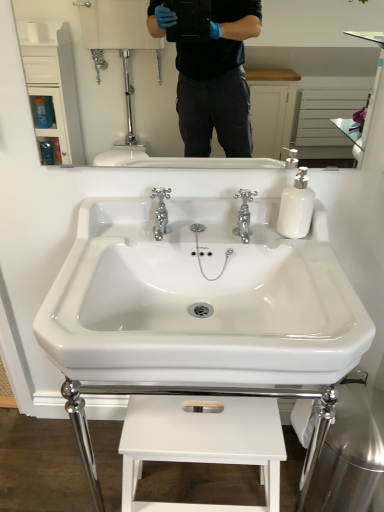
Measure the distance between point (168, 226) and camera.

The distance of point (168, 226) from camera is 3.53 feet.

The image size is (384, 512). What do you see at coordinates (201, 300) in the screenshot? I see `white glossy sink at center` at bounding box center [201, 300].

What do you see at coordinates (202, 442) in the screenshot? This screenshot has height=512, width=384. I see `white matte stool at lower center` at bounding box center [202, 442].

The height and width of the screenshot is (512, 384). What do you see at coordinates (318, 41) in the screenshot?
I see `white glossy mirror at upper center` at bounding box center [318, 41].

What is the approximate width of white glossy mirror at upper center?

white glossy mirror at upper center is 0.83 inches in width.

I want to click on white glossy soap dispenser at right, so click(x=296, y=207).

From the image's perspective, which one is positioned lower, chrome metallic faucet at center, the 2th tap from the left, or white glossy mirror at upper center?

chrome metallic faucet at center, the 2th tap from the left, appears lower in the image.

Is chrome metallic faucet at center, acting as the 1th tap starting from the right, wider than white glossy mirror at upper center?

Correct, the width of chrome metallic faucet at center, acting as the 1th tap starting from the right, exceeds that of white glossy mirror at upper center.

Can you tell me how much chrome metallic faucet at center, the 2th tap from the left, and white glossy mirror at upper center differ in facing direction?

0.421 degrees separate the facing orientations of chrome metallic faucet at center, the 2th tap from the left, and white glossy mirror at upper center.

Considering the sizes of objects chrome metallic faucet at center, acting as the 1th tap starting from the right, and white glossy mirror at upper center in the image provided, who is taller, chrome metallic faucet at center, acting as the 1th tap starting from the right, or white glossy mirror at upper center?

white glossy mirror at upper center.

From a real-world perspective, who is located higher, white glossy mirror at upper center or chrome metallic faucet at center, the 2th tap from the left?

white glossy mirror at upper center is physically above.

Considering the sizes of objects white glossy mirror at upper center and chrome metallic faucet at center, acting as the 1th tap starting from the right, in the image provided, who is taller, white glossy mirror at upper center or chrome metallic faucet at center, acting as the 1th tap starting from the right,?

white glossy mirror at upper center.

Is white glossy mirror at upper center positioned with its back to chrome metallic faucet at center, acting as the 1th tap starting from the right?

white glossy mirror at upper center is not turned away from chrome metallic faucet at center, acting as the 1th tap starting from the right.

Considering the relative positions of white glossy mirror at upper center and chrome metallic faucet at center, the 2th tap from the left, in the image provided, is white glossy mirror at upper center in front of chrome metallic faucet at center, the 2th tap from the left,?

Yes, white glossy mirror at upper center is closer to the viewer.

Between white glossy soap dispenser at right and white glossy sink at center, which one has less height?

white glossy soap dispenser at right is shorter.

Does white glossy soap dispenser at right turn towards white glossy sink at center?

No, white glossy soap dispenser at right does not turn towards white glossy sink at center.

Would you say white glossy soap dispenser at right is inside or outside white glossy sink at center?

white glossy soap dispenser at right is contained in white glossy sink at center.

Which object is closer to the camera, white glossy soap dispenser at right or white glossy sink at center?

white glossy sink at center is closer to the camera.

Can you confirm if white glossy mirror at upper center is bigger than white matte stool at lower center?

No.

Looking at this image, from the image's perspective, who appears lower, white glossy mirror at upper center or white matte stool at lower center?

white matte stool at lower center is shown below in the image.

Do you think white glossy mirror at upper center is within white matte stool at lower center, or outside of it?

white glossy mirror at upper center is not inside white matte stool at lower center, it's outside.

Consider the image. How different are the orientations of white glossy mirror at upper center and white matte stool at lower center in degrees?

The angular difference between white glossy mirror at upper center and white matte stool at lower center is 0.421 degrees.

Is white glossy sink at center taller or shorter than white glossy mirror at upper center?

Considering their sizes, white glossy sink at center has less height than white glossy mirror at upper center.

Is white glossy sink at center oriented towards white glossy mirror at upper center?

No, white glossy sink at center is not turned towards white glossy mirror at upper center.

Can you confirm if white glossy sink at center is thinner than white glossy mirror at upper center?

No.

In order to click on sink to the left of white glossy mirror at upper center in this screenshot , I will do `click(201, 300)`.

You are a GUI agent. You are given a task and a screenshot of the screen. Output one action in this format:
    pyautogui.click(x=<x>, y=<y>)
    Task: Click on the mirror lying above the white glossy soap dispenser at right (from the image's perspective)
    
    Given the screenshot: What is the action you would take?
    pyautogui.click(x=318, y=41)

From the image's perspective, is white glossy mirror at upper center below white glossy soap dispenser at right?

No, from the image's perspective, white glossy mirror at upper center is not below white glossy soap dispenser at right.

What's the angular difference between white glossy mirror at upper center and white glossy soap dispenser at right's facing directions?

The angle between the facing direction of white glossy mirror at upper center and the facing direction of white glossy soap dispenser at right is 0.421 degrees.

In the scene shown: Who is bigger, white glossy mirror at upper center or white glossy soap dispenser at right?

Bigger between the two is white glossy mirror at upper center.

Can you confirm if white glossy soap dispenser at right is smaller than chrome metallic faucet at center, the 2th tap from the left?

Actually, white glossy soap dispenser at right might be larger than chrome metallic faucet at center, the 2th tap from the left.

From the white glossy soap dispenser at right, count the 1st tap to the left and point to it. Please provide its 2D coordinates.

[(244, 215)]

From the image's perspective, is white glossy soap dispenser at right located above or below chrome metallic faucet at center, the 2th tap from the left?

From the image's perspective, white glossy soap dispenser at right appears above chrome metallic faucet at center, the 2th tap from the left.

How different are the orientations of white glossy soap dispenser at right and chrome metallic faucet at center, acting as the 1th tap starting from the right, in degrees?

0.00111 degrees.

This screenshot has width=384, height=512. I want to click on mirror above the chrome metallic faucet at center, the 2th tap from the left (from a real-world perspective), so click(318, 41).

Locate an element on the screen. mirror above the chrome metallic faucet at center, the 2th tap from the left (from the image's perspective) is located at coordinates (318, 41).

Which object lies further to the anchor point white glossy mirror at upper center, white glossy soap dispenser at right or chrome metallic faucet at center, arranged as the first tap when viewed from the left?

white glossy soap dispenser at right.

When comparing their distances from chrome metallic faucet at center, the 2th tap from the left, does white matte stool at lower center or white glossy soap dispenser at right seem further?

The object further to chrome metallic faucet at center, the 2th tap from the left, is white matte stool at lower center.

Based on their spatial positions, is chrome metallic faucet at center, acting as the 1th tap starting from the right, or white matte stool at lower center closer to white glossy mirror at upper center?

chrome metallic faucet at center, acting as the 1th tap starting from the right.

Which object lies nearer to the anchor point chrome metallic faucet at center, the second tap when ordered from right to left, white glossy mirror at upper center or chrome metallic faucet at center, acting as the 1th tap starting from the right?

Based on the image, chrome metallic faucet at center, acting as the 1th tap starting from the right, appears to be nearer to chrome metallic faucet at center, the second tap when ordered from right to left.

Looking at the image, which one is located further to white matte stool at lower center, white glossy mirror at upper center or white glossy soap dispenser at right?

white glossy mirror at upper center lies further to white matte stool at lower center than the other object.

Based on their spatial positions, is white glossy mirror at upper center or chrome metallic faucet at center, arranged as the first tap when viewed from the left, closer to white glossy sink at center?

Based on the image, chrome metallic faucet at center, arranged as the first tap when viewed from the left, appears to be nearer to white glossy sink at center.

Considering their positions, is white glossy sink at center positioned closer to chrome metallic faucet at center, acting as the 1th tap starting from the right, than chrome metallic faucet at center, arranged as the first tap when viewed from the left?

Based on the image, chrome metallic faucet at center, arranged as the first tap when viewed from the left, appears to be nearer to chrome metallic faucet at center, acting as the 1th tap starting from the right.

Which object lies further to the anchor point white glossy soap dispenser at right, white glossy sink at center or white glossy mirror at upper center?

white glossy mirror at upper center.

Where is `sink between white glossy mirror at upper center and white matte stool at lower center in the vertical direction`? The image size is (384, 512). sink between white glossy mirror at upper center and white matte stool at lower center in the vertical direction is located at coordinates 201,300.

You are a GUI agent. You are given a task and a screenshot of the screen. Output one action in this format:
    pyautogui.click(x=<x>, y=<y>)
    Task: Click on the tap between chrome metallic faucet at center, arranged as the first tap when viewed from the left, and white matte stool at lower center from top to bottom
    The width and height of the screenshot is (384, 512).
    Given the screenshot: What is the action you would take?
    pyautogui.click(x=244, y=215)

This screenshot has width=384, height=512. I want to click on soap dispenser between white glossy mirror at upper center and chrome metallic faucet at center, acting as the 1th tap starting from the right, from top to bottom, so click(296, 207).

Image resolution: width=384 pixels, height=512 pixels. What are the coordinates of `sink between chrome metallic faucet at center, the 2th tap from the left, and white matte stool at lower center from top to bottom` in the screenshot? It's located at (201, 300).